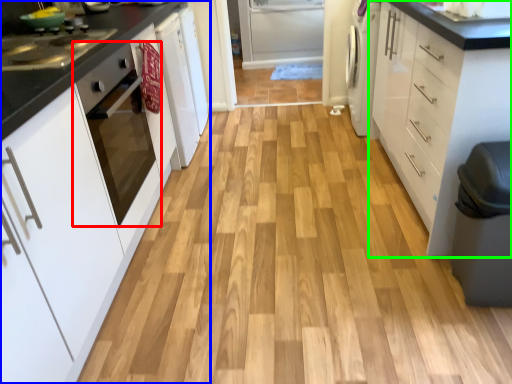
Question: Which is nearer to the home appliance (highlighted by a red box)? cabinetry (highlighted by a blue box) or cabinetry (highlighted by a green box).

Choices:
 (A) cabinetry
 (B) cabinetry

Answer: (A)